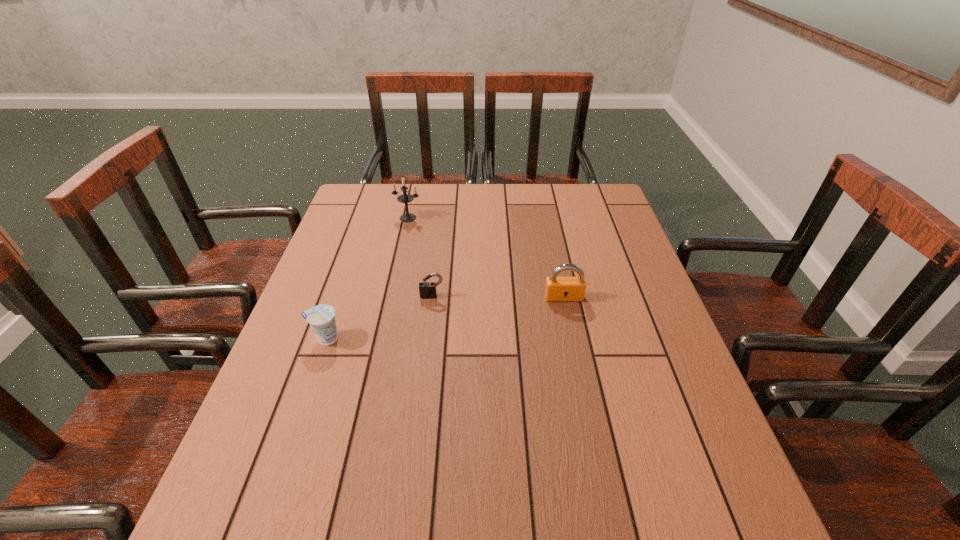
This screenshot has height=540, width=960. I want to click on vacant space that is in between the second object from left to right and the nearest object, so click(367, 278).

The image size is (960, 540). I want to click on empty space that is in between the right padlock and the leftmost object, so click(x=444, y=318).

This screenshot has height=540, width=960. In order to click on free space between the yogurt and the shorter padlock in this screenshot , I will do `click(379, 318)`.

Locate an element on the screen. This screenshot has height=540, width=960. vacant space that is in between the third object from left to right and the second object from left to right is located at coordinates (420, 257).

Find the location of a particular element. vacant space that is in between the candle holder and the nearest object is located at coordinates (367, 278).

Where is `free spot between the yogurt and the third object from left to right`? The image size is (960, 540). free spot between the yogurt and the third object from left to right is located at coordinates (379, 318).

At what (x,y) coordinates should I click in order to perform the action: click on vacant space that is in between the tallest object and the nearest object. Please return your answer as a coordinate pair (x, y). This screenshot has height=540, width=960. Looking at the image, I should click on (367, 278).

At what (x,y) coordinates should I click in order to perform the action: click on empty location between the rightmost object and the left padlock. Please return your answer as a coordinate pair (x, y). Image resolution: width=960 pixels, height=540 pixels. Looking at the image, I should click on (498, 297).

Where is `unoccupied area between the nearest object and the candle holder`? unoccupied area between the nearest object and the candle holder is located at coordinates (367, 278).

At what (x,y) coordinates should I click in order to perform the action: click on the closest object relative to the tallest object. Please return your answer as a coordinate pair (x, y). The width and height of the screenshot is (960, 540). Looking at the image, I should click on (427, 290).